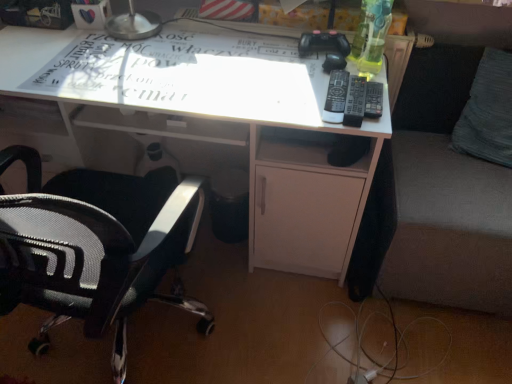
Find the location of a particular element. vacant area to the left of black plastic remote at right, the 3th remote when ordered from left to right is located at coordinates (302, 95).